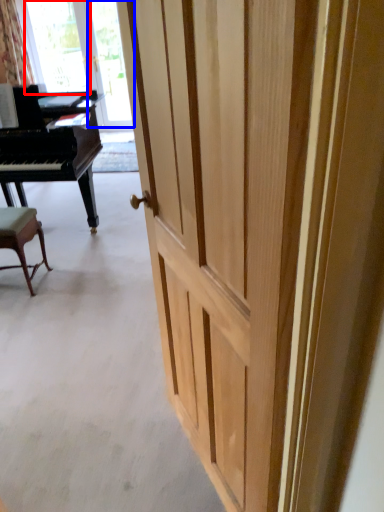
Question: Which point is closer to the camera, window screen (highlighted by a red box) or glass door (highlighted by a blue box)?

Choices:
 (A) window screen
 (B) glass door

Answer: (B)